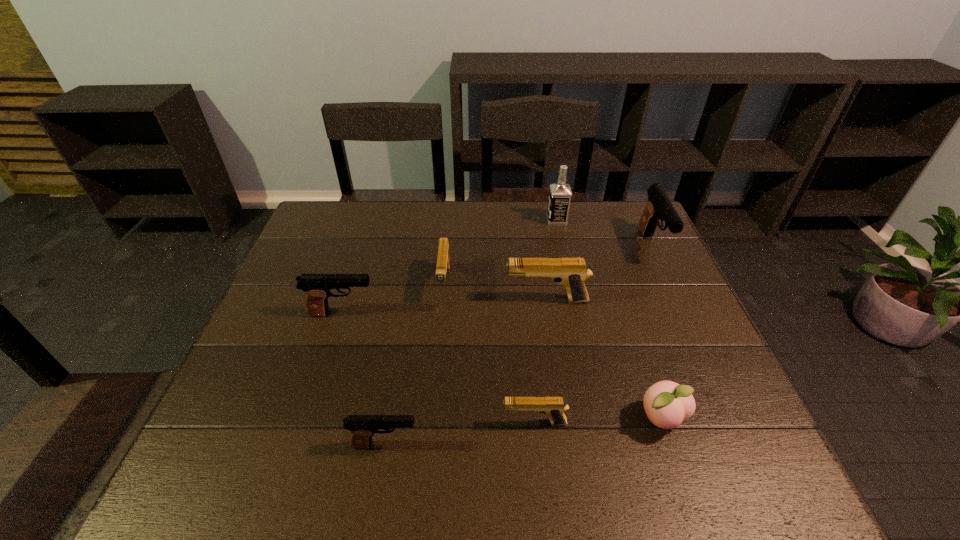
The width and height of the screenshot is (960, 540). Find the location of `the nearest black pistol`. the nearest black pistol is located at coordinates (363, 427).

Locate an element on the screen. The height and width of the screenshot is (540, 960). the second black pistol from right to left is located at coordinates (363, 427).

This screenshot has height=540, width=960. In order to click on the shortest object in this screenshot , I will do `click(554, 407)`.

Locate an element on the screen. This screenshot has height=540, width=960. the smallest tan pistol is located at coordinates (554, 407).

This screenshot has height=540, width=960. In order to click on vacant space situated 0.080m on the front label of the vodka in this screenshot , I will do [x=523, y=220].

Identify the location of vacant area situated 0.260m on the front label of the vodka. This screenshot has width=960, height=540. [469, 220].

Locate an element on the screen. free location located 0.200m on the front label of the vodka is located at coordinates (487, 220).

Locate an element on the screen. The height and width of the screenshot is (540, 960). free region located at the barrel of the biggest black pistol is located at coordinates (685, 319).

Identify the location of blank space located 0.220m at the barrel of the biggest tan pistol. This screenshot has height=540, width=960. (423, 300).

At what (x,y) coordinates should I click in order to perform the action: click on vacant space positioned at the barrel of the biggest tan pistol. Please return your answer as a coordinate pair (x, y). Looking at the image, I should click on (453, 300).